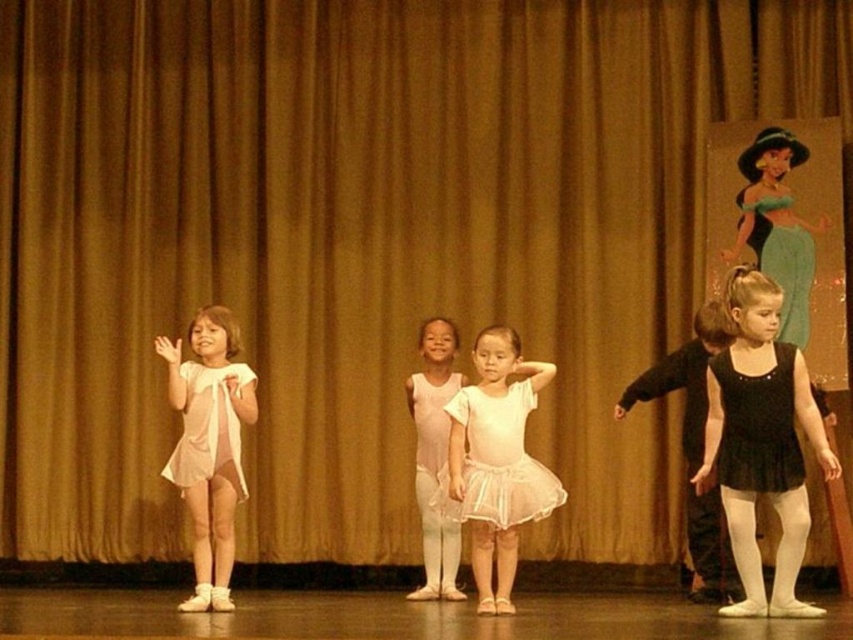
You are a photographer setting up for a ballet performance. You need to ensure that both the black satin dress at upper right and the translucent white dress at left are clearly visible in your shot. Given their height difference, where should you position your camera to capture both effectively?

The black satin dress at upper right is much taller than the translucent white dress at left. To ensure both are visible, position the camera at a lower angle so that the taller black satin dress at upper right doesn not block the shorter translucent white dress at left.